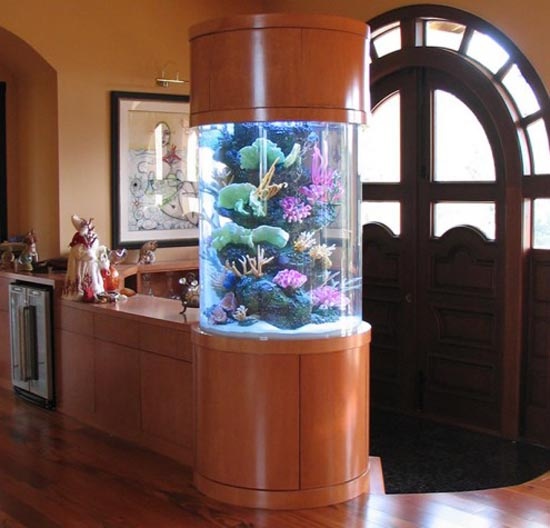
This screenshot has height=528, width=550. I want to click on door, so click(448, 318).